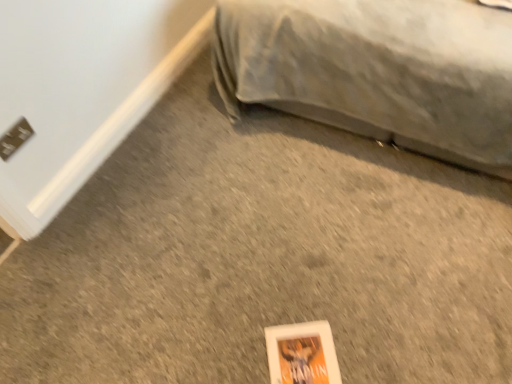
Where is `empty space that is ontop of white matte paperback book at lower center (from a real-world perspective)`? empty space that is ontop of white matte paperback book at lower center (from a real-world perspective) is located at coordinates (296, 358).